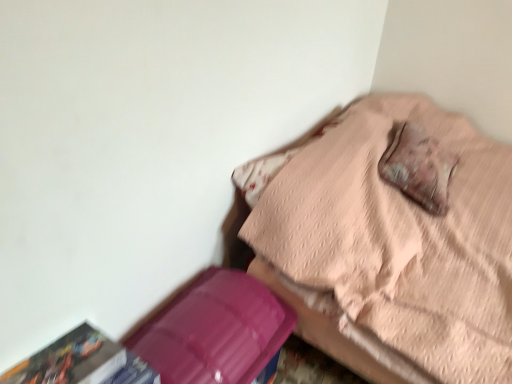
Question: Looking at the image, does purple plastic box at lower left seem bigger or smaller compared to leather-like brown pillow at upper right?

Choices:
 (A) big
 (B) small

Answer: (A)

Question: Would you say purple plastic box at lower left is to the left or to the right of leather-like brown pillow at upper right in the picture?

Choices:
 (A) left
 (B) right

Answer: (A)

Question: Estimate the real-world distances between objects in this image. Which object is closer to the pink quilted bed at upper right?

Choices:
 (A) leather-like brown pillow at upper right
 (B) purple plastic box at lower left
 (C) multicolored paper at lower left

Answer: (A)

Question: Which is nearer to the pink quilted bed at upper right?

Choices:
 (A) purple plastic box at lower left
 (B) multicolored paper at lower left
 (C) leather-like brown pillow at upper right

Answer: (C)